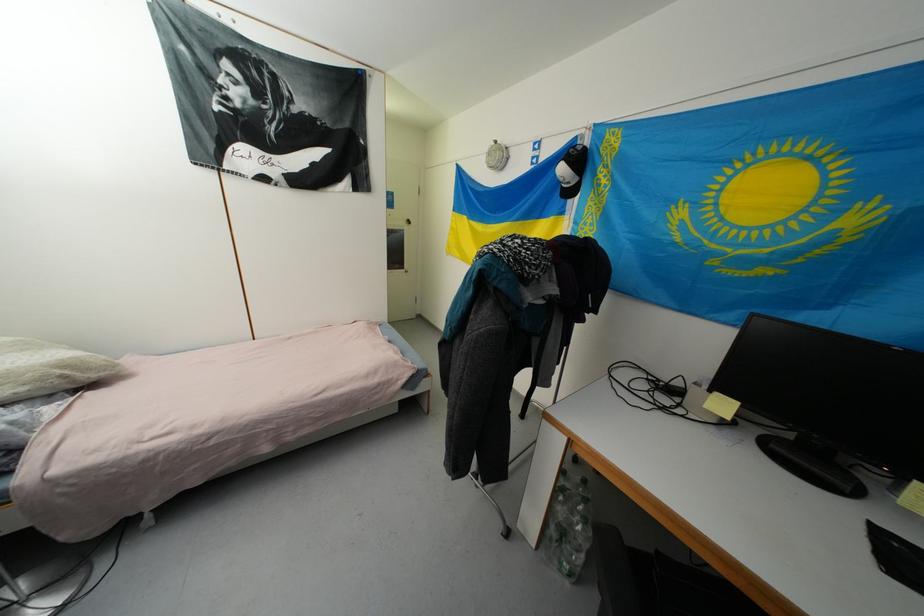
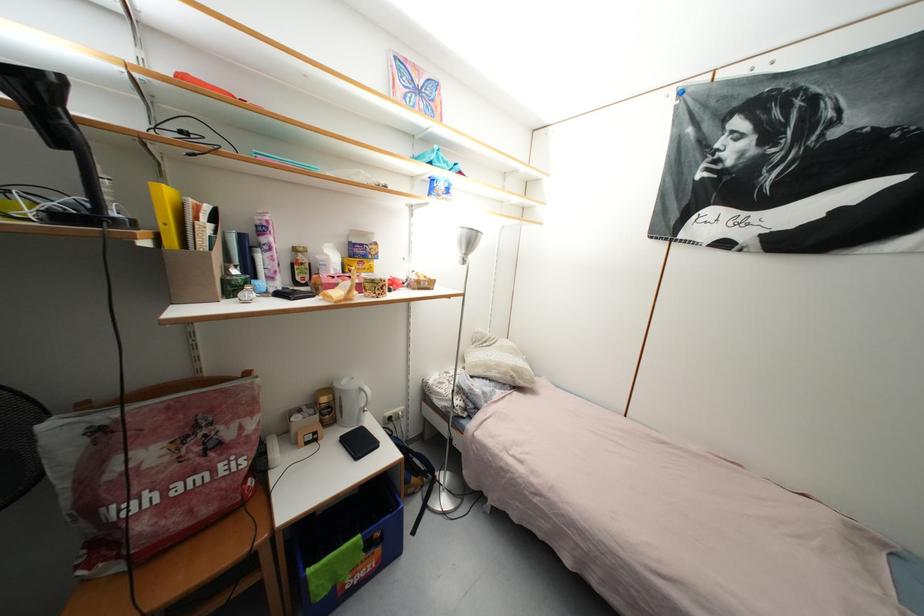
Question: The camera is either moving clockwise (left) or counter-clockwise (right) around the object. The first image is from the beginning of the video and the second image is from the end. Is the camera moving left or right when shooting the video?

Choices:
 (A) Left
 (B) Right

Answer: (B)